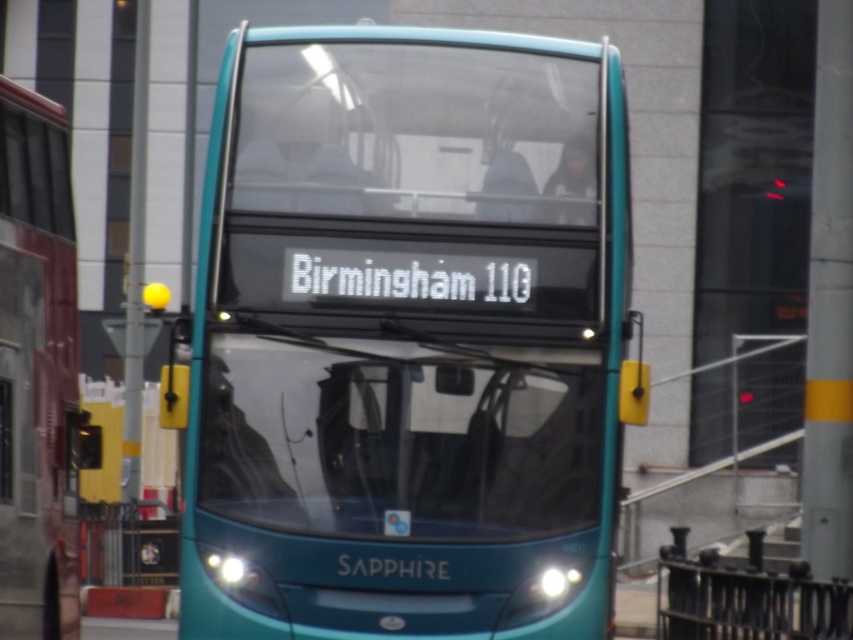
Question: Which point is farther from the camera taking this photo?

Choices:
 (A) (321, 33)
 (B) (39, 412)

Answer: (B)

Question: Is teal glossy bus at center in front of teal glossy bus at left?

Choices:
 (A) no
 (B) yes

Answer: (B)

Question: Which point is closer to the camera taking this photo?

Choices:
 (A) (10, 595)
 (B) (274, 515)

Answer: (B)

Question: Is teal glossy bus at center above teal glossy bus at left?

Choices:
 (A) yes
 (B) no

Answer: (A)

Question: Observing the image, what is the correct spatial positioning of teal glossy bus at center in reference to teal glossy bus at left?

Choices:
 (A) right
 (B) left

Answer: (A)